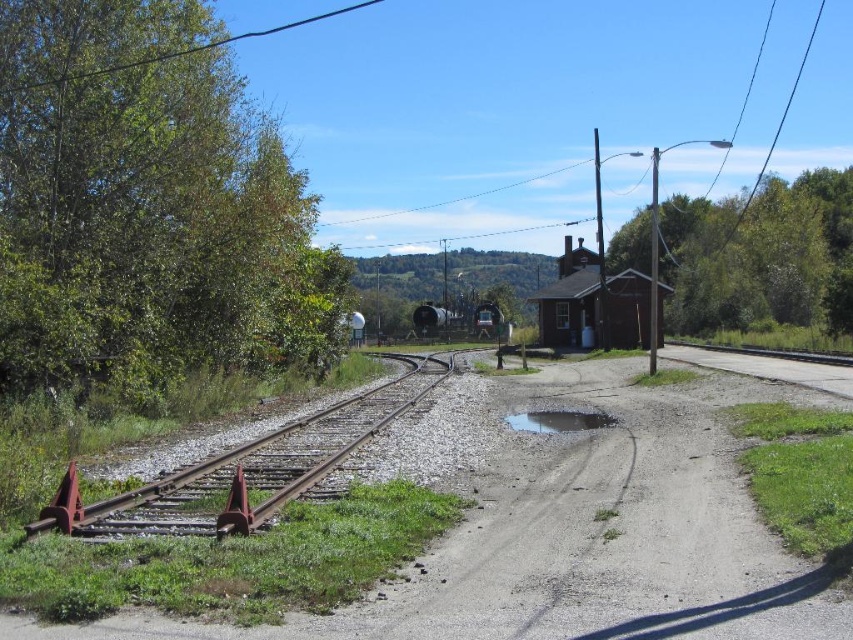
Measure the distance between point (105, 68) and camera.

Point (105, 68) and camera are 18.53 meters apart.

Is green leafy tree at left bigger than glossy concrete puddle at center?

Correct, green leafy tree at left is larger in size than glossy concrete puddle at center.

Which is behind, point (94, 45) or point (596, 422)?

The point (94, 45) is behind.

Where is `green leafy tree at left`? The width and height of the screenshot is (853, 640). green leafy tree at left is located at coordinates (144, 205).

Is point (451, 304) positioned after point (537, 422)?

Yes.

Is green leafy tree at center below glossy concrete puddle at center?

Incorrect, green leafy tree at center is not positioned below glossy concrete puddle at center.

Is point (357, 273) positioned after point (527, 417)?

That is True.

Find the location of a particular element. green leafy tree at center is located at coordinates (448, 282).

Which is more to the right, rusty metal train track at left or green leafy tree at center?

From the viewer's perspective, rusty metal train track at left appears more on the right side.

Can you confirm if rusty metal train track at left is shorter than green leafy tree at center?

Indeed, rusty metal train track at left has a lesser height compared to green leafy tree at center.

Which is in front, point (242, 509) or point (438, 301)?

Point (242, 509) is more forward.

Identify the location of rusty metal train track at left. (252, 467).